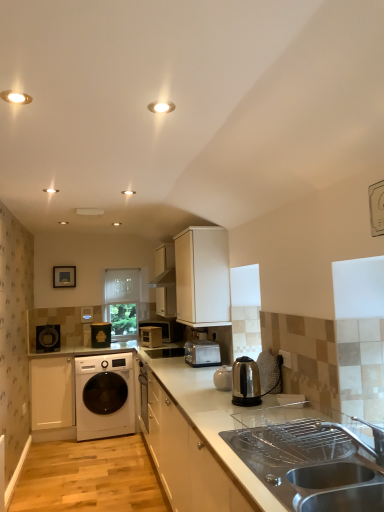
This screenshot has width=384, height=512. In order to click on vacant point to the left of stainless steel kettle at center, positioned as the 1th home appliance in front-to-back order in this screenshot , I will do [x=211, y=406].